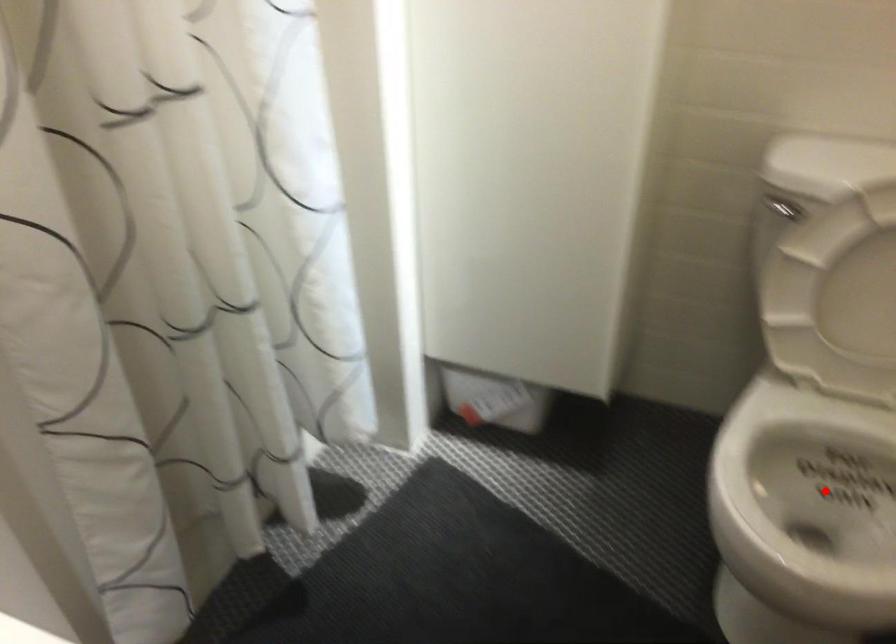
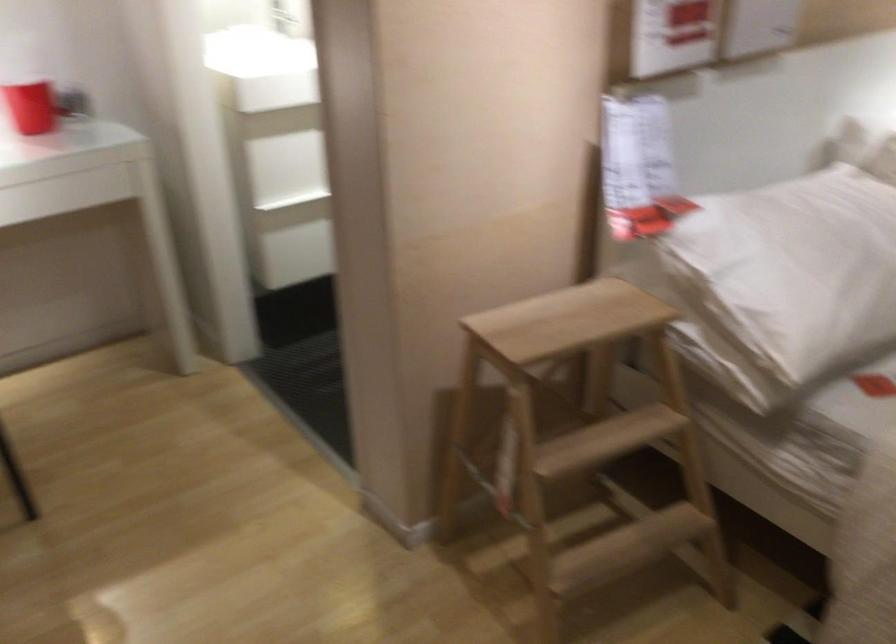
Question: I am providing you with two images of the same scene from different viewpoints. A red point is marked on the first image. Is the red point's position out of view in image 2?

Choices:
 (A) Yes
 (B) No

Answer: (A)